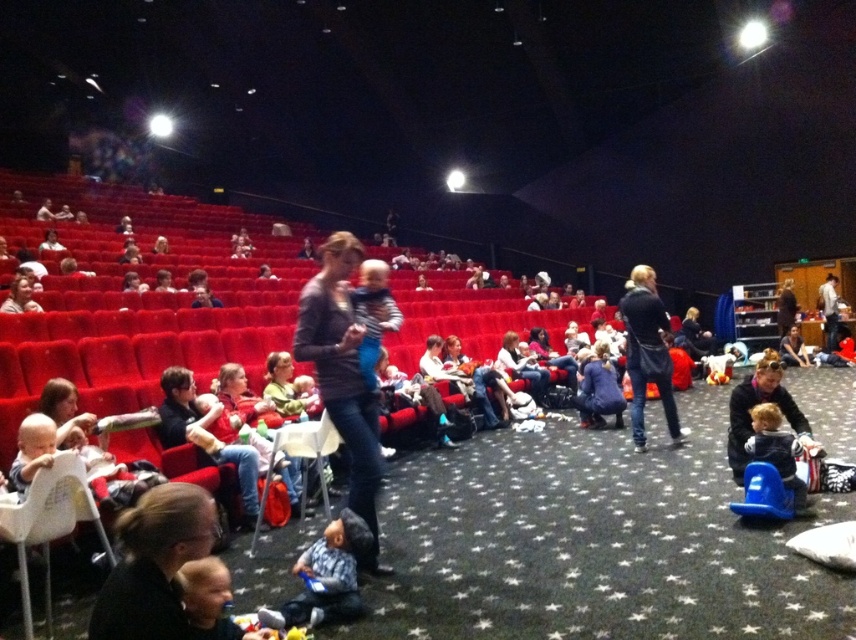
Measure the distance between matte gray sweater at center and camera.

matte gray sweater at center is 9.56 feet away from camera.

Is matte gray sweater at center closer to camera compared to light brown plush toy at lower right?

That is True.

Is point (304, 330) positioned before point (800, 502)?

Yes.

Where is `matte gray sweater at center`? matte gray sweater at center is located at coordinates 343,378.

Between matte gray sweater at center and dark brown leather jacket at lower left, which one is positioned lower?

dark brown leather jacket at lower left is below.

Between matte gray sweater at center and dark brown leather jacket at lower left, which one appears on the left side from the viewer's perspective?

Positioned to the left is dark brown leather jacket at lower left.

Is point (376, 486) positioned in front of point (140, 500)?

No, (376, 486) is behind (140, 500).

Where is `matte gray sweater at center`? The image size is (856, 640). matte gray sweater at center is located at coordinates (343, 378).

Which is above, dark blue jacket at center or light brown plush toy at lower right?

dark blue jacket at center is higher up.

In the scene shown: Between dark blue jacket at center and light brown plush toy at lower right, which one is positioned lower?

Positioned lower is light brown plush toy at lower right.

Identify the location of dark blue jacket at center. (646, 353).